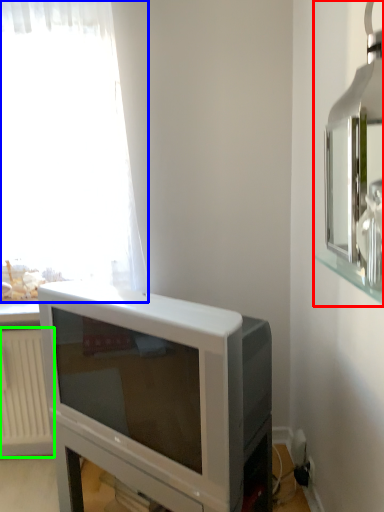
Question: Estimate the real-world distances between objects in this image. Which object is closer to medicine cabinet (highlighted by a red box), curtain (highlighted by a blue box) or radiator (highlighted by a green box)?

Choices:
 (A) curtain
 (B) radiator

Answer: (A)